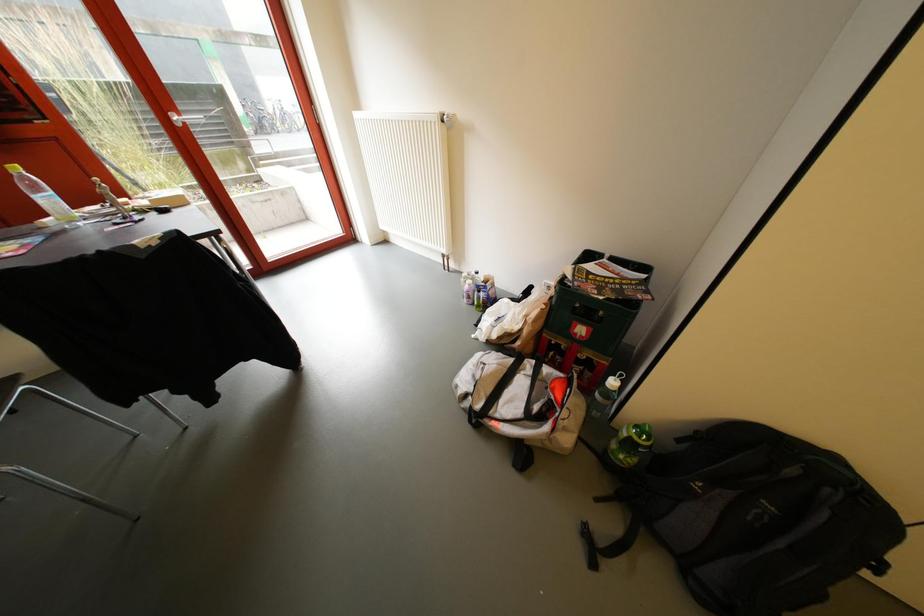
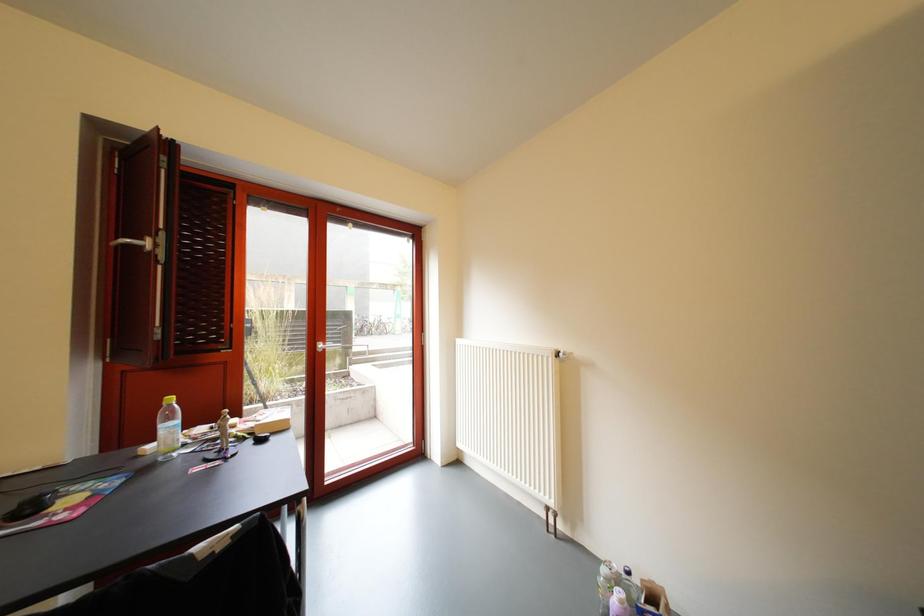
Question: The first image is from the beginning of the video and the second image is from the end. How did the camera likely rotate when shooting the video?

Choices:
 (A) Left
 (B) Right
 (C) Up
 (D) Down

Answer: (C)